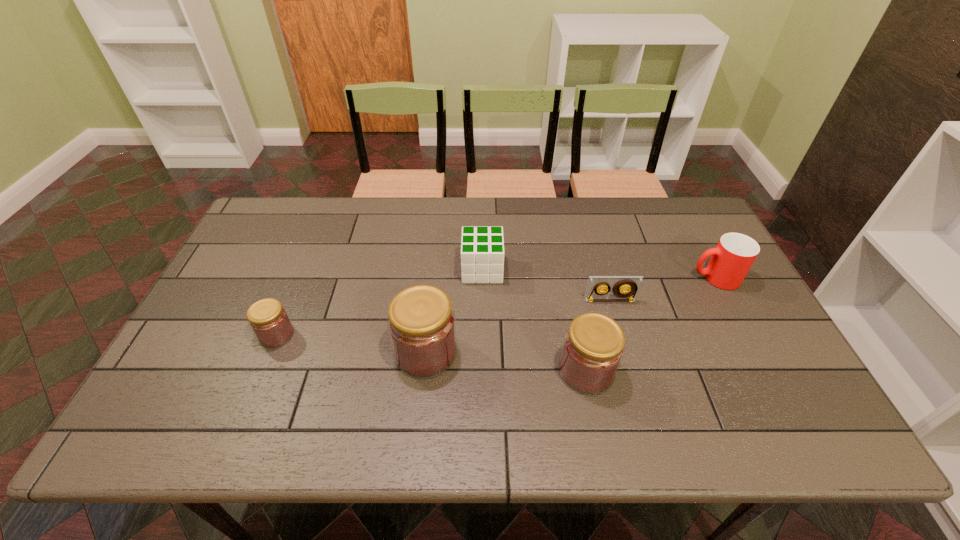
Where is `vacant space situated 0.060m on the side of the cup with the handle`? Image resolution: width=960 pixels, height=540 pixels. vacant space situated 0.060m on the side of the cup with the handle is located at coordinates (670, 278).

At what (x,y) coordinates should I click in order to perform the action: click on free space located on the side of the cup with the handle. Please return your answer as a coordinate pair (x, y). Looking at the image, I should click on (579, 278).

This screenshot has height=540, width=960. What are the coordinates of `vacant area situated on the side of the cup with the handle` in the screenshot? It's located at (643, 278).

This screenshot has height=540, width=960. Identify the location of free space located 0.190m at the front of the fourth nearest object with visible reels. [x=626, y=360].

Image resolution: width=960 pixels, height=540 pixels. I want to click on vacant space located on the red face of the fourth object from right to left, so [x=329, y=269].

Find the location of a particular element. Image resolution: width=960 pixels, height=540 pixels. vacant area situated 0.250m on the red face of the fourth object from right to left is located at coordinates (379, 269).

The image size is (960, 540). I want to click on free space located on the red face of the fourth object from right to left, so click(x=402, y=269).

The image size is (960, 540). Find the location of `object present at the right edge`. object present at the right edge is located at coordinates (735, 253).

Where is `free space at the far edge of the desktop`? free space at the far edge of the desktop is located at coordinates (522, 203).

The height and width of the screenshot is (540, 960). In the image, there is a desktop. What are the coordinates of `vacant space at the left edge` in the screenshot? It's located at (246, 242).